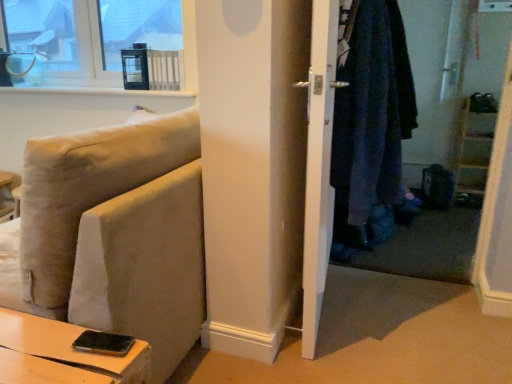
Question: Is denim jacket at right further to camera compared to beige fabric couch at lower left?

Choices:
 (A) yes
 (B) no

Answer: (A)

Question: Are denim jacket at right and beige fabric couch at lower left located far from each other?

Choices:
 (A) yes
 (B) no

Answer: (A)

Question: From a real-world perspective, is denim jacket at right below beige fabric couch at lower left?

Choices:
 (A) yes
 (B) no

Answer: (B)

Question: From the image's perspective, is denim jacket at right on beige fabric couch at lower left?

Choices:
 (A) no
 (B) yes

Answer: (B)

Question: Considering the relative positions of denim jacket at right and beige fabric couch at lower left in the image provided, is denim jacket at right in front of beige fabric couch at lower left?

Choices:
 (A) yes
 (B) no

Answer: (B)

Question: From a real-world perspective, is white glossy door at center positioned above or below clear glass window at upper left?

Choices:
 (A) above
 (B) below

Answer: (B)

Question: Considering the positions of white glossy door at center and clear glass window at upper left in the image, is white glossy door at center bigger or smaller than clear glass window at upper left?

Choices:
 (A) big
 (B) small

Answer: (B)

Question: In the image, is white glossy door at center on the left side or the right side of clear glass window at upper left?

Choices:
 (A) right
 (B) left

Answer: (A)

Question: Do you think white glossy door at center is within clear glass window at upper left, or outside of it?

Choices:
 (A) inside
 (B) outside

Answer: (B)

Question: From the image's perspective, is white glossy door at center above or below denim jacket at right?

Choices:
 (A) above
 (B) below

Answer: (B)

Question: Considering the relative positions of white glossy door at center and denim jacket at right in the image provided, is white glossy door at center to the left or to the right of denim jacket at right?

Choices:
 (A) left
 (B) right

Answer: (A)

Question: Looking at their shapes, would you say white glossy door at center is wider or thinner than denim jacket at right?

Choices:
 (A) wide
 (B) thin

Answer: (B)

Question: Relative to denim jacket at right, is white glossy door at center in front or behind?

Choices:
 (A) behind
 (B) front

Answer: (B)

Question: Considering the positions of denim jacket at right and white glossy door at center in the image, is denim jacket at right bigger or smaller than white glossy door at center?

Choices:
 (A) big
 (B) small

Answer: (A)

Question: Is denim jacket at right taller or shorter than white glossy door at center?

Choices:
 (A) tall
 (B) short

Answer: (B)